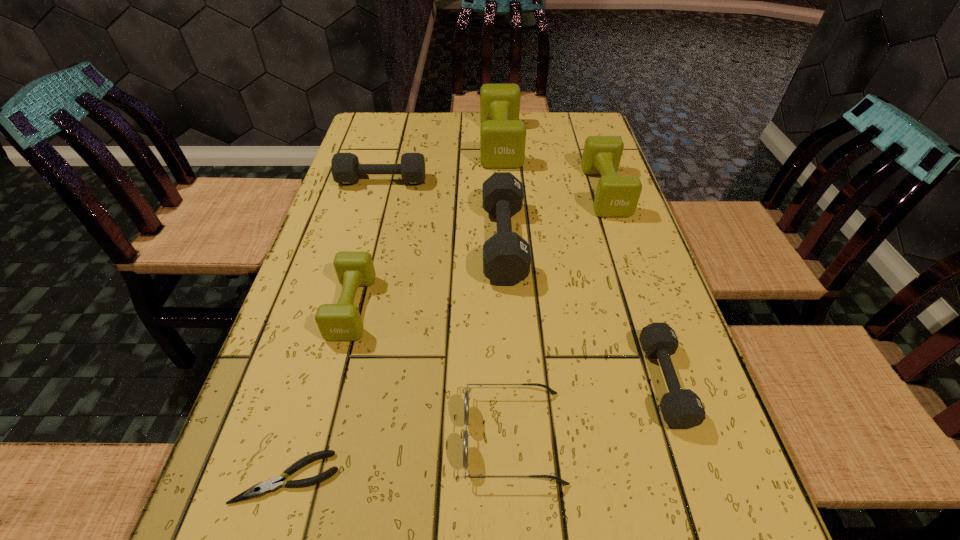
The height and width of the screenshot is (540, 960). I want to click on the tallest dumbbell, so click(x=502, y=135).

What are the coordinates of `the biggest olive dumbbell` in the screenshot? It's located at (502, 135).

Find the location of `the rightmost olive dumbbell`. the rightmost olive dumbbell is located at coordinates (616, 195).

The image size is (960, 540). I want to click on the biggest gray dumbbell, so click(x=506, y=256).

You are a GUI agent. You are given a task and a screenshot of the screen. Output one action in this format:
    pyautogui.click(x=<x>, y=<y>)
    Task: Click on the second nearest gray dumbbell
    This screenshot has height=540, width=960.
    Given the screenshot: What is the action you would take?
    pyautogui.click(x=506, y=256)

At what (x,y) coordinates should I click in order to perform the action: click on the farthest gray dumbbell. Please return your answer as a coordinate pair (x, y). This screenshot has height=540, width=960. Looking at the image, I should click on (345, 167).

Where is `the leftmost gray dumbbell`? the leftmost gray dumbbell is located at coordinates (345, 167).

Locate an element on the screen. the leftmost olive dumbbell is located at coordinates (337, 322).

I want to click on the smallest olive dumbbell, so click(337, 322).

Find the location of a particular element. the rightmost gray dumbbell is located at coordinates (681, 408).